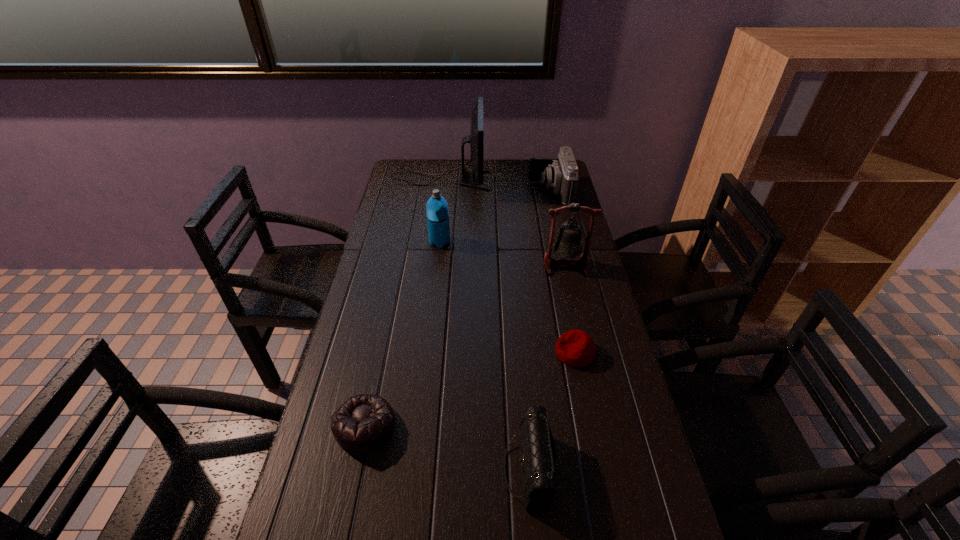
Identify the location of vacant area that lies between the farther beanbag and the fourth tallest object. This screenshot has width=960, height=540. (563, 272).

The image size is (960, 540). What are the coordinates of `empty location between the fourth tallest object and the farther beanbag` in the screenshot? It's located at (563, 272).

You are a GUI agent. You are given a task and a screenshot of the screen. Output one action in this format:
    pyautogui.click(x=<x>, y=<y>)
    Task: Click on the vacant space that is in between the third nearest object and the camera
    The width and height of the screenshot is (960, 540).
    Given the screenshot: What is the action you would take?
    pyautogui.click(x=563, y=272)

This screenshot has height=540, width=960. Identify the location of object that is the fifth closest to the fifth tallest object. (561, 174).

Select which object appears as the sixth closest to the fifth nearest object. Please provide its 2D coordinates. Your answer should be formatted as a tuple, i.e. [(x, y)], where the tuple contains the x and y coordinates of a point satisfying the conditions above.

[(538, 452)]

This screenshot has width=960, height=540. Find the location of `free space in the image that satisfies the following two spatial constraints: 1. on the back side of the nearer beanbag; 2. on the left side of the thermos bottle`. free space in the image that satisfies the following two spatial constraints: 1. on the back side of the nearer beanbag; 2. on the left side of the thermos bottle is located at coordinates (403, 242).

Locate an element on the screen. free spot that satisfies the following two spatial constraints: 1. on the back side of the third tallest object; 2. on the right side of the left beanbag is located at coordinates (403, 242).

Find the location of a particular element. The image size is (960, 540). blank area in the image that satisfies the following two spatial constraints: 1. on the front side of the fourth farthest object; 2. on the seat area of the farther beanbag is located at coordinates (586, 353).